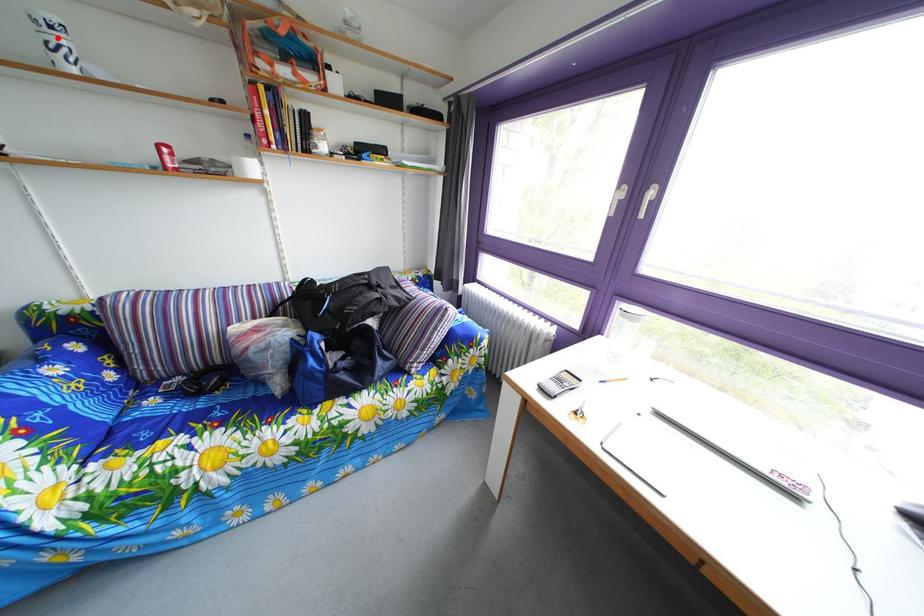
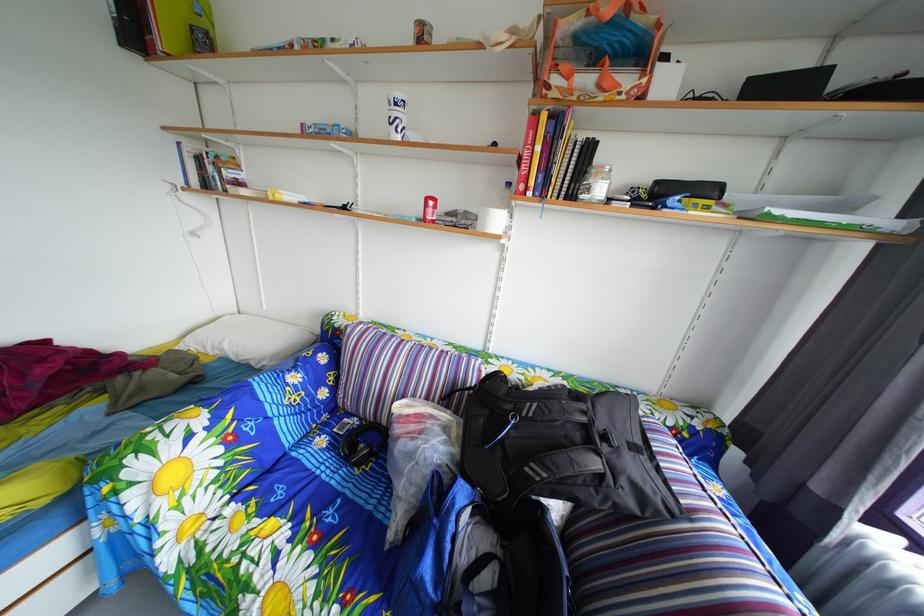
Where in the second image is the point corresponding to the highlighted location from the first image?

(404, 116)